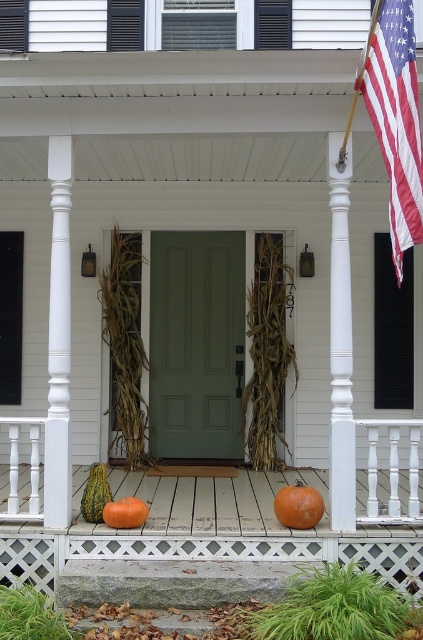
You are a delivery person trying to place a package on the porch. You see the matte orange pumpkin at lower center and the orange matte pumpkin at lower center. Which pumpkin can you place the package on without it being too unstable?

The matte orange pumpkin at lower center has a larger size compared to orange matte pumpkin at lower center, so placing the package on the matte orange pumpkin at lower center would be more stable due to its larger base.

You are standing on the front porch of the house and want to hang a wreath on the white painted wood post at left. However, there is an american flag at upper right. Can you hang the wreath without moving the flag?

The american flag at upper right is in front of the white painted wood post at left, so the flag is blocking the post. You would need to move the flag to access the post and hang the wreath.